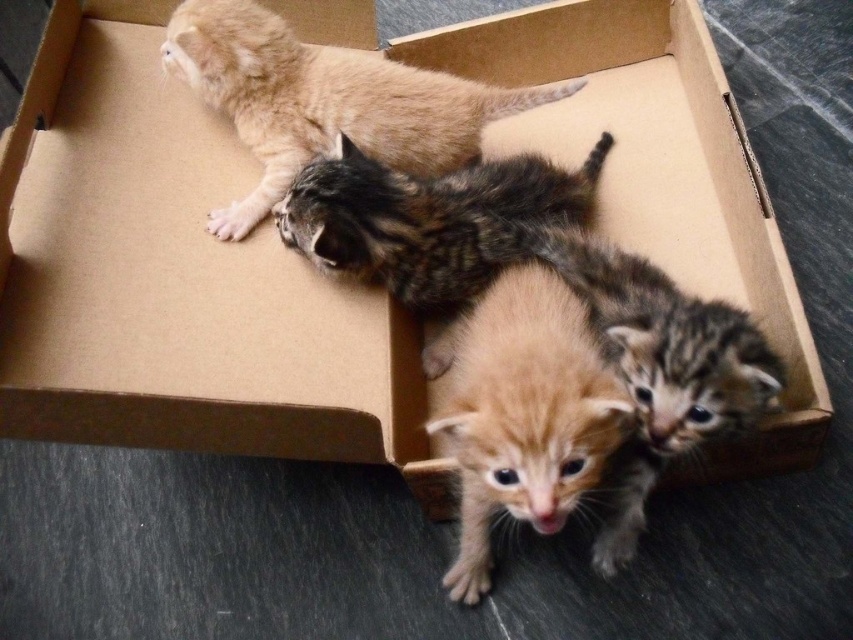
Question: Which object appears farthest from the camera in this image?

Choices:
 (A) fluffy orange kitten at center
 (B) golden fur kitten at upper left
 (C) tabby fur cat at center

Answer: (B)

Question: Does golden fur kitten at upper left appear on the right side of tabby fur cat at center?

Choices:
 (A) yes
 (B) no

Answer: (B)

Question: In this image, where is golden fur kitten at upper left located relative to tabby fur cat at center?

Choices:
 (A) left
 (B) right

Answer: (A)

Question: Which is nearer to the tabby fur cat at center?

Choices:
 (A) golden fur kitten at upper left
 (B) fluffy orange kitten at center

Answer: (A)

Question: Among these objects, which one is farthest from the camera?

Choices:
 (A) golden fur kitten at upper left
 (B) tabby fur cat at center
 (C) fluffy orange kitten at center

Answer: (A)

Question: Is golden fur kitten at upper left behind tabby fur cat at center?

Choices:
 (A) no
 (B) yes

Answer: (B)